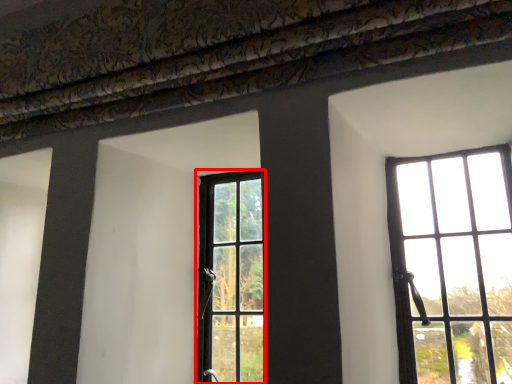
Question: From the image's perspective, considering the relative positions of window (annotated by the red box) and window in the image provided, where is window (annotated by the red box) located with respect to the staircase?

Choices:
 (A) above
 (B) below

Answer: (B)